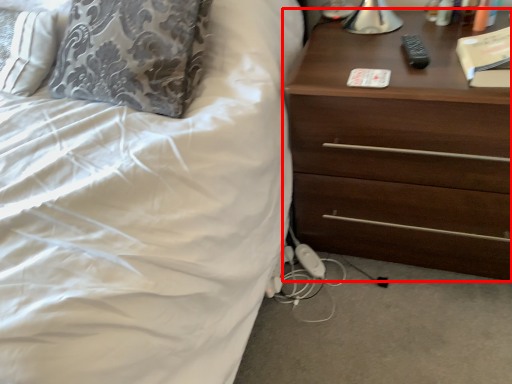
Question: From the image's perspective, what is the correct spatial relationship of chest of drawers (annotated by the red box) in relation to book?

Choices:
 (A) below
 (B) above

Answer: (A)